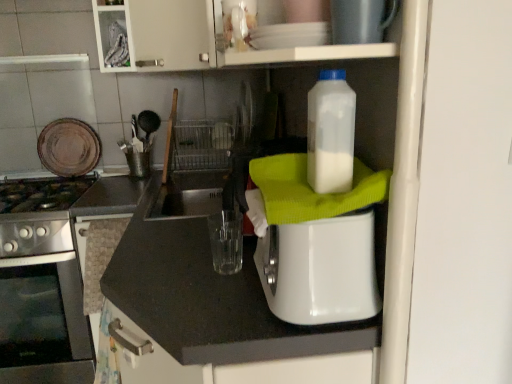
Question: Is brown matte plate at upper left, which is the third appliance in front-to-back order, outside of white plastic toaster at center, the second appliance from the left?

Choices:
 (A) yes
 (B) no

Answer: (A)

Question: Can you confirm if brown matte plate at upper left, which is the third appliance in front-to-back order, is positioned to the right of white plastic toaster at center, which ranks as the second appliance in right-to-left order?

Choices:
 (A) no
 (B) yes

Answer: (A)

Question: Can you confirm if brown matte plate at upper left, which is the third appliance in front-to-back order, is wider than white plastic toaster at center, which ranks as the second appliance in right-to-left order?

Choices:
 (A) no
 (B) yes

Answer: (A)

Question: Considering the relative sizes of brown matte plate at upper left, which is counted as the third appliance, starting from the right, and white plastic toaster at center, marked as the 2th appliance in a front-to-back arrangement, in the image provided, is brown matte plate at upper left, which is counted as the third appliance, starting from the right, taller than white plastic toaster at center, marked as the 2th appliance in a front-to-back arrangement,?

Choices:
 (A) yes
 (B) no

Answer: (B)

Question: Is white plastic toaster at center, which ranks as the 2th appliance in back-to-front order, a part of brown matte plate at upper left, the first appliance from the back?

Choices:
 (A) yes
 (B) no

Answer: (B)

Question: Would you say brown matte plate at upper left, the first appliance from the back, is to the left or to the right of metallic silver toaster at upper center, the third appliance from the back, in the picture?

Choices:
 (A) right
 (B) left

Answer: (B)

Question: Is point (78, 162) positioned closer to the camera than point (388, 26)?

Choices:
 (A) farther
 (B) closer

Answer: (A)

Question: From the image's perspective, is brown matte plate at upper left, which is counted as the third appliance, starting from the right, located above or below metallic silver toaster at upper center, marked as the first appliance in a right-to-left arrangement?

Choices:
 (A) above
 (B) below

Answer: (B)

Question: From a real-world perspective, relative to metallic silver toaster at upper center, the third appliance when ordered from left to right, is brown matte plate at upper left, which is counted as the third appliance, starting from the right, vertically above or below?

Choices:
 (A) below
 (B) above

Answer: (A)

Question: Is metallic silver toaster at upper center, the first appliance positioned from the front, in front of or behind translucent plastic bottle at upper right in the image?

Choices:
 (A) front
 (B) behind

Answer: (A)

Question: Is metallic silver toaster at upper center, the third appliance when ordered from left to right, bigger or smaller than translucent plastic bottle at upper right?

Choices:
 (A) big
 (B) small

Answer: (B)

Question: Is metallic silver toaster at upper center, the third appliance when ordered from left to right, spatially inside translucent plastic bottle at upper right, or outside of it?

Choices:
 (A) inside
 (B) outside

Answer: (B)

Question: From the image's perspective, is metallic silver toaster at upper center, the third appliance when ordered from left to right, located above or below translucent plastic bottle at upper right?

Choices:
 (A) above
 (B) below

Answer: (A)

Question: Looking at the image, does white plastic toaster at center, the second appliance from the left, seem bigger or smaller compared to translucent plastic bottle at upper right?

Choices:
 (A) small
 (B) big

Answer: (B)

Question: Is white plastic toaster at center, the second appliance from the left, in front of or behind translucent plastic bottle at upper right in the image?

Choices:
 (A) behind
 (B) front

Answer: (B)